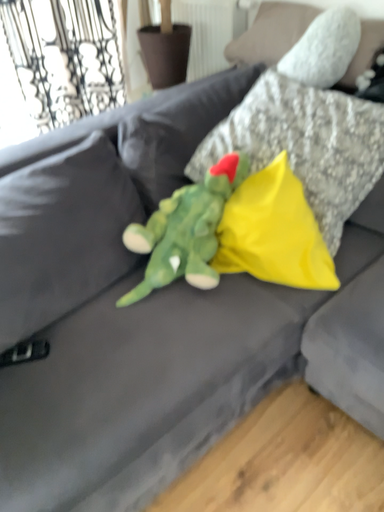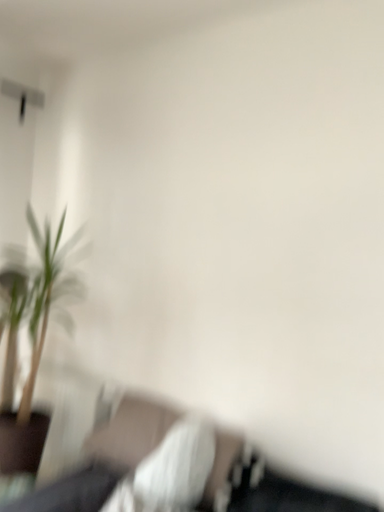
Question: How did the camera likely rotate when shooting the video?

Choices:
 (A) rotated downward
 (B) rotated upward

Answer: (B)